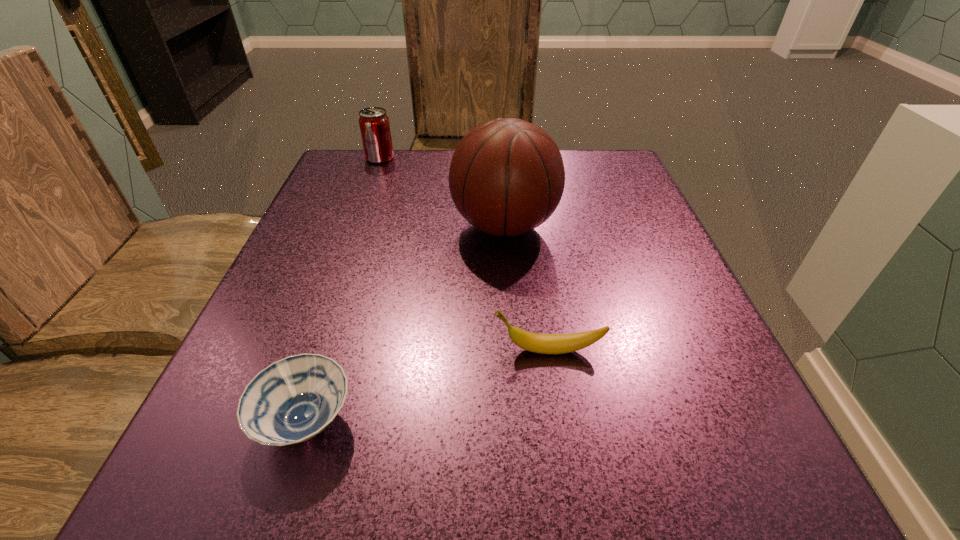
Identify the location of vacant point located at the stem of the second nearest object. (445, 350).

I want to click on blank space located at the stem of the second nearest object, so click(x=438, y=350).

The image size is (960, 540). In order to click on free space located at the stem of the second nearest object in this screenshot , I will do `click(452, 350)`.

This screenshot has height=540, width=960. I want to click on blank space located 0.210m on the back of the soup bowl, so click(x=352, y=277).

Find the location of a particular element. basketball that is positioned at the far edge is located at coordinates (506, 177).

Find the location of `pop soda that is at the far edge`. pop soda that is at the far edge is located at coordinates (374, 124).

You are a GUI agent. You are given a task and a screenshot of the screen. Output one action in this format:
    pyautogui.click(x=<x>, y=<y>)
    Task: Click on the object located in the near edge section of the desktop
    This screenshot has width=960, height=540.
    Given the screenshot: What is the action you would take?
    pyautogui.click(x=292, y=400)

I want to click on pop soda that is at the left edge, so click(x=374, y=124).

Locate an element on the screen. This screenshot has width=960, height=540. soup bowl situated at the left edge is located at coordinates (292, 400).

Where is `object that is at the far left corner`? Image resolution: width=960 pixels, height=540 pixels. object that is at the far left corner is located at coordinates (374, 124).